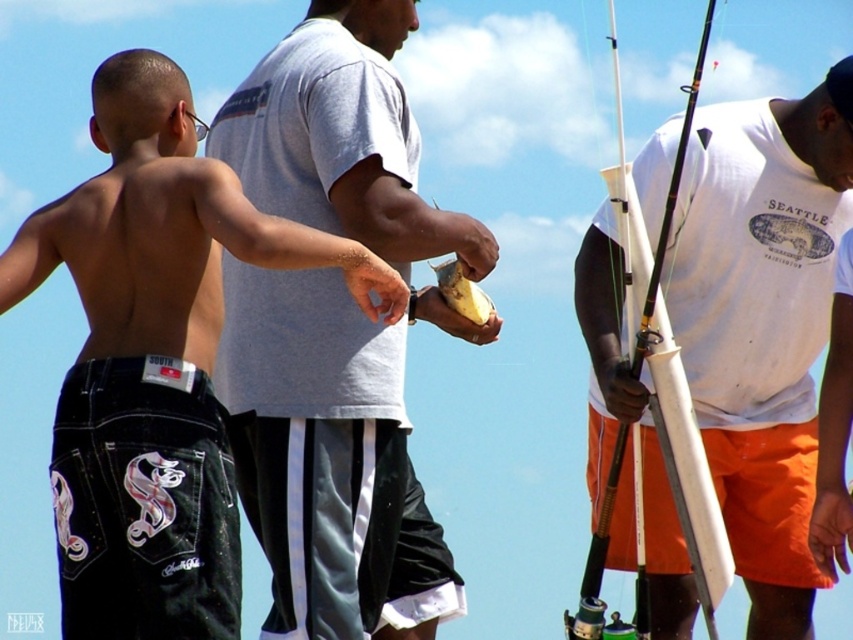
Is point (352, 49) closer to viewer compared to point (608, 396)?

No, it is behind (608, 396).

Can you confirm if matte gray t-shirt at center is thinner than white matte fishing rod at center?

Yes.

Which is in front, point (283, 593) or point (750, 266)?

Positioned in front is point (283, 593).

At what (x,y) coordinates should I click in order to perform the action: click on matte gray t-shirt at center. Please return your answer as a coordinate pair (x, y). The height and width of the screenshot is (640, 853). Looking at the image, I should click on (328, 460).

Which of these two, white matte fishing rod at center or black denim shorts at lower left, stands shorter?

black denim shorts at lower left

Does white matte fishing rod at center lie behind black denim shorts at lower left?

That is True.

Who is more forward, (578, 292) or (120, 563)?

Positioned in front is point (120, 563).

Where is `white matte fishing rod at center`? white matte fishing rod at center is located at coordinates (763, 323).

Which is more to the right, matte gray t-shirt at center or black denim shorts at left?

Positioned to the right is matte gray t-shirt at center.

Is matte gray t-shirt at center to the left of black denim shorts at left from the viewer's perspective?

In fact, matte gray t-shirt at center is to the right of black denim shorts at left.

Which is in front, point (288, 480) or point (53, 467)?

Point (53, 467) is more forward.

The height and width of the screenshot is (640, 853). Identify the location of matte gray t-shirt at center. (328, 460).